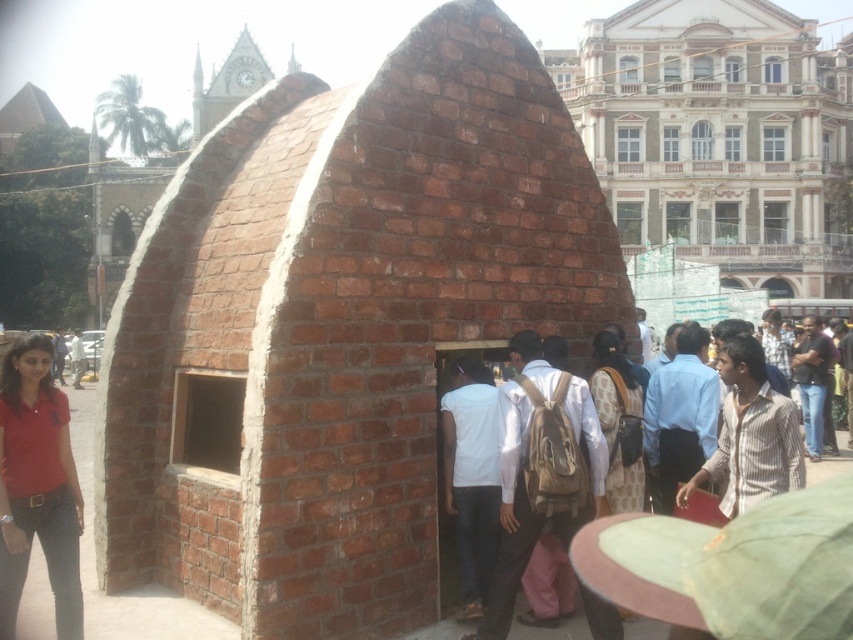
You are standing at the entrance of the dome structure and want to take a photo of the brown backpack at center. Your camera is 48.45 meters away from the backpack. Is the camera within a 50 meter range for optimal photo clarity? Please answer with yes or no.

Yes, the camera is within 50 meters of the brown backpack at center since they are 48.45 meters apart, which is under the 50 meter optimal range for photo clarity.

You are a photographer trying to capture a clear shot of the brown backpack at center without any obstructions from the matte red polo shirt at lower left. Can you adjust your position to do so?

The brown backpack at center is positioned under the matte red polo shirt at lower left, so moving your position to look from above or the side might allow you to capture the backpack without obstruction from the polo shirt.

You are standing in the outdoor scene and need to decide which item is taller between the brown backpack at center and the matte red polo shirt at lower left. Which one is taller?

The brown backpack at center has a greater height compared to the matte red polo shirt at lower left.